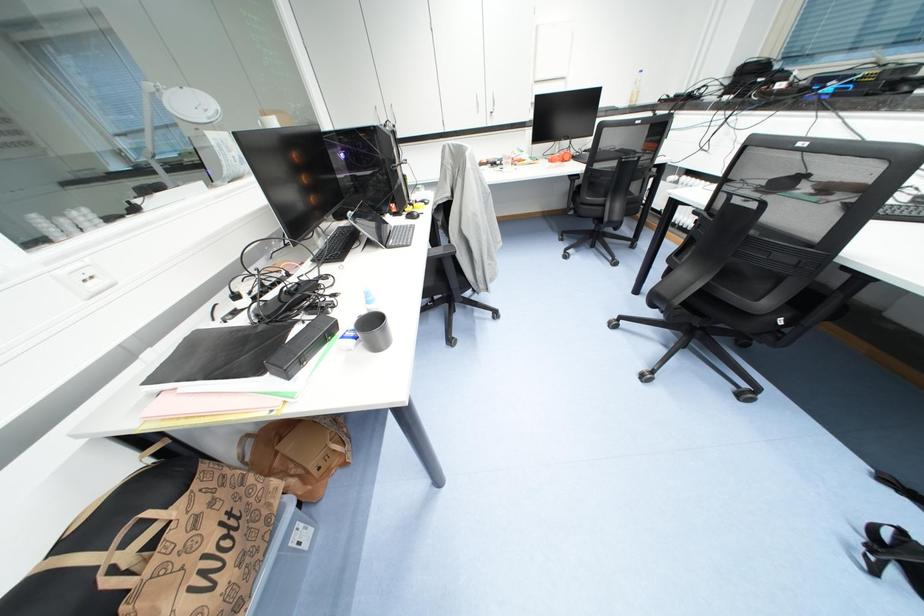
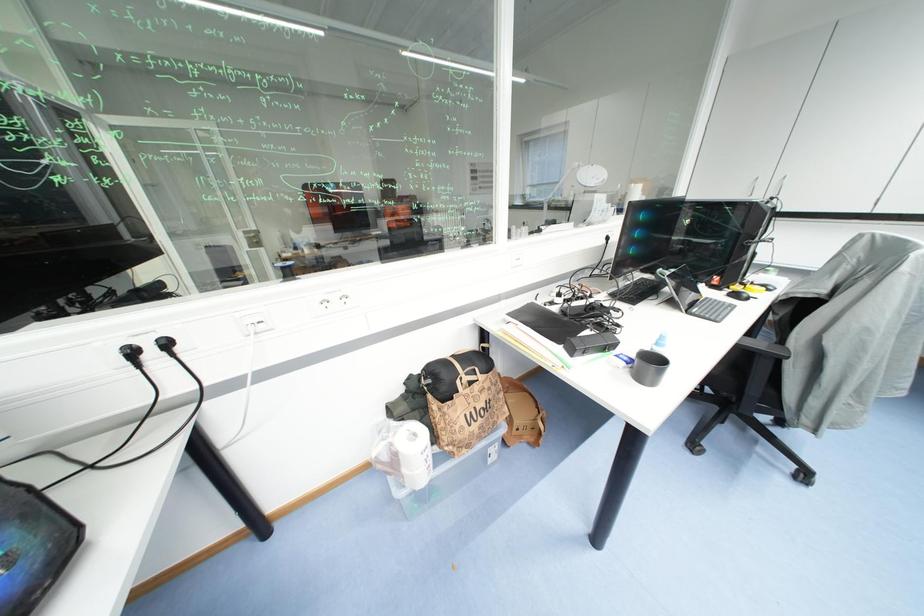
Question: How did the camera likely rotate?

Choices:
 (A) Left
 (B) Right
 (C) Up
 (D) Down

Answer: (A)